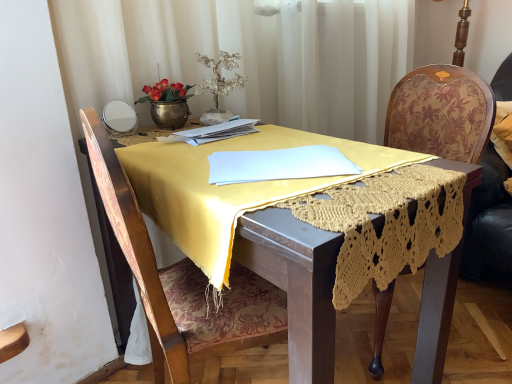
Locate an element on the screen. wooden chair at center, which is counted as the first chair, starting from the left is located at coordinates (179, 279).

What do you see at coordinates (441, 113) in the screenshot? I see `wooden floral-patterned chair at right, marked as the 1th chair in a right-to-left arrangement` at bounding box center [441, 113].

I want to click on yellow fabric table at center, so click(x=296, y=284).

Considering the positions of objects yellow fabric table at center and wooden chair at center, which is counted as the first chair, starting from the left, in the image provided, who is more to the left, yellow fabric table at center or wooden chair at center, which is counted as the first chair, starting from the left,?

wooden chair at center, which is counted as the first chair, starting from the left.

Is yellow fabric table at center not inside wooden chair at center, which is counted as the first chair, starting from the left?

No, yellow fabric table at center is inside or overlapping with wooden chair at center, which is counted as the first chair, starting from the left.

Does yellow fabric table at center have a lesser width compared to wooden chair at center, which is counted as the first chair, starting from the left?

No, yellow fabric table at center is not thinner than wooden chair at center, which is counted as the first chair, starting from the left.

Is wooden chair at center, which ranks as the 2th chair in right-to-left order, at the right side of velvet floral swivel chair at right?

Incorrect, wooden chair at center, which ranks as the 2th chair in right-to-left order, is not on the right side of velvet floral swivel chair at right.

How many degrees apart are the facing directions of wooden chair at center, which ranks as the 2th chair in right-to-left order, and velvet floral swivel chair at right?

There is a 98.7-degree angle between the facing directions of wooden chair at center, which ranks as the 2th chair in right-to-left order, and velvet floral swivel chair at right.

Can we say wooden chair at center, which ranks as the 2th chair in right-to-left order, lies outside velvet floral swivel chair at right?

Indeed, wooden chair at center, which ranks as the 2th chair in right-to-left order, is completely outside velvet floral swivel chair at right.

From a real-world perspective, between wooden chair at center, which is counted as the first chair, starting from the left, and velvet floral swivel chair at right, who is vertically lower?

wooden chair at center, which is counted as the first chair, starting from the left.

From the image's perspective, does white paper at center appear higher than yellow fabric table at center?

Yes, from the image's perspective, white paper at center is over yellow fabric table at center.

From the picture: Which object is positioned more to the left, white paper at center or yellow fabric table at center?

Positioned to the left is white paper at center.

Can you confirm if white paper at center is bigger than yellow fabric table at center?

Incorrect, white paper at center is not larger than yellow fabric table at center.

The width and height of the screenshot is (512, 384). What are the coordinates of `notebook behind the yellow fabric table at center` in the screenshot? It's located at (213, 132).

Which point is more forward, (146, 250) or (275, 249)?

The point (275, 249) is more forward.

From the image's perspective, which is below, wooden chair at center, which ranks as the 2th chair in right-to-left order, or yellow fabric table at center?

yellow fabric table at center.

Is wooden chair at center, which ranks as the 2th chair in right-to-left order, located outside yellow fabric table at center?

No, wooden chair at center, which ranks as the 2th chair in right-to-left order, is not outside of yellow fabric table at center.

Consider the image. Is wooden chair at center, which is counted as the first chair, starting from the left, oriented away from yellow fabric table at center?

Yes, wooden chair at center, which is counted as the first chair, starting from the left, is positioned with its back facing yellow fabric table at center.

Is velvet floral swivel chair at right inside the boundaries of wooden chair at center, which ranks as the 2th chair in right-to-left order, or outside?

velvet floral swivel chair at right is not inside wooden chair at center, which ranks as the 2th chair in right-to-left order, it's outside.

Is velvet floral swivel chair at right smaller than wooden chair at center, which is counted as the first chair, starting from the left?

Yes, velvet floral swivel chair at right is smaller than wooden chair at center, which is counted as the first chair, starting from the left.

Who is more distant, velvet floral swivel chair at right or wooden chair at center, which ranks as the 2th chair in right-to-left order?

velvet floral swivel chair at right.

Is velvet floral swivel chair at right far away from wooden chair at center, which ranks as the 2th chair in right-to-left order?

Yes.

Considering the sizes of objects velvet floral swivel chair at right and white paper at center in the image provided, who is taller, velvet floral swivel chair at right or white paper at center?

velvet floral swivel chair at right is taller.

Looking at this image, from a real-world perspective, is velvet floral swivel chair at right physically below white paper at center?

Yes, from a real-world perspective, velvet floral swivel chair at right is under white paper at center.

Based on the photo, which is more to the left, velvet floral swivel chair at right or white paper at center?

white paper at center.

Is velvet floral swivel chair at right touching white paper at center?

No.

How many degrees apart are the facing directions of wooden floral-patterned chair at right, marked as the 1th chair in a right-to-left arrangement, and velvet floral swivel chair at right?

wooden floral-patterned chair at right, marked as the 1th chair in a right-to-left arrangement, and velvet floral swivel chair at right are facing 69.2 degrees away from each other.

Between point (435, 271) and point (487, 192), which one is positioned in front?

The point (435, 271) is closer.

Which of these two, wooden floral-patterned chair at right, marked as the 1th chair in a right-to-left arrangement, or velvet floral swivel chair at right, is bigger?

With larger size is wooden floral-patterned chair at right, marked as the 1th chair in a right-to-left arrangement.

This screenshot has width=512, height=384. I want to click on round table on the right of wooden chair at center, which ranks as the 2th chair in right-to-left order, so click(x=296, y=284).

Identify the location of swivel chair above the wooden chair at center, which ranks as the 2th chair in right-to-left order (from the image's perspective). The height and width of the screenshot is (384, 512). (489, 224).

Considering their positions, is yellow fabric table at center positioned further to wooden chair at center, which is counted as the first chair, starting from the left, than wooden floral-patterned chair at right, marked as the 1th chair in a right-to-left arrangement?

The object further to wooden chair at center, which is counted as the first chair, starting from the left, is wooden floral-patterned chair at right, marked as the 1th chair in a right-to-left arrangement.

Looking at the image, which one is located closer to white paper at center, wooden floral-patterned chair at right, marked as the 1th chair in a right-to-left arrangement, or velvet floral swivel chair at right?

wooden floral-patterned chair at right, marked as the 1th chair in a right-to-left arrangement.

Based on their spatial positions, is white paper at center or yellow fabric table at center further from wooden floral-patterned chair at right, placed as the second chair when sorted from left to right?

yellow fabric table at center is positioned further to the anchor wooden floral-patterned chair at right, placed as the second chair when sorted from left to right.

Which object lies nearer to the anchor point wooden chair at center, which is counted as the first chair, starting from the left, wooden floral-patterned chair at right, placed as the second chair when sorted from left to right, or yellow fabric table at center?

yellow fabric table at center.

Estimate the real-world distances between objects in this image. Which object is further from yellow fabric table at center, white paper at center or velvet floral swivel chair at right?

Among the two, velvet floral swivel chair at right is located further to yellow fabric table at center.

From the picture: Which object lies nearer to the anchor point yellow fabric table at center, wooden floral-patterned chair at right, marked as the 1th chair in a right-to-left arrangement, or white paper at center?

white paper at center is positioned closer to the anchor yellow fabric table at center.

Estimate the real-world distances between objects in this image. Which object is further from wooden chair at center, which ranks as the 2th chair in right-to-left order, white paper at center or velvet floral swivel chair at right?

velvet floral swivel chair at right is further to wooden chair at center, which ranks as the 2th chair in right-to-left order.

From the image, which object appears to be nearer to yellow fabric table at center, white paper at center or wooden floral-patterned chair at right, placed as the second chair when sorted from left to right?

white paper at center.

You are a GUI agent. You are given a task and a screenshot of the screen. Output one action in this format:
    pyautogui.click(x=<x>, y=<y>)
    Task: Click on the chair situated between wooden chair at center, which is counted as the first chair, starting from the left, and velvet floral swivel chair at right from left to right
    This screenshot has height=384, width=512.
    Given the screenshot: What is the action you would take?
    pyautogui.click(x=441, y=113)

Find the location of a particular element. The image size is (512, 384). round table between wooden chair at center, which is counted as the first chair, starting from the left, and wooden floral-patterned chair at right, placed as the second chair when sorted from left to right is located at coordinates (296, 284).

Where is `round table between white paper at center and wooden floral-patterned chair at right, placed as the second chair when sorted from left to right, in the horizontal direction`? The height and width of the screenshot is (384, 512). round table between white paper at center and wooden floral-patterned chair at right, placed as the second chair when sorted from left to right, in the horizontal direction is located at coordinates (296, 284).

The image size is (512, 384). Find the location of `chair located between yellow fabric table at center and velvet floral swivel chair at right in the left-right direction`. chair located between yellow fabric table at center and velvet floral swivel chair at right in the left-right direction is located at coordinates (441, 113).